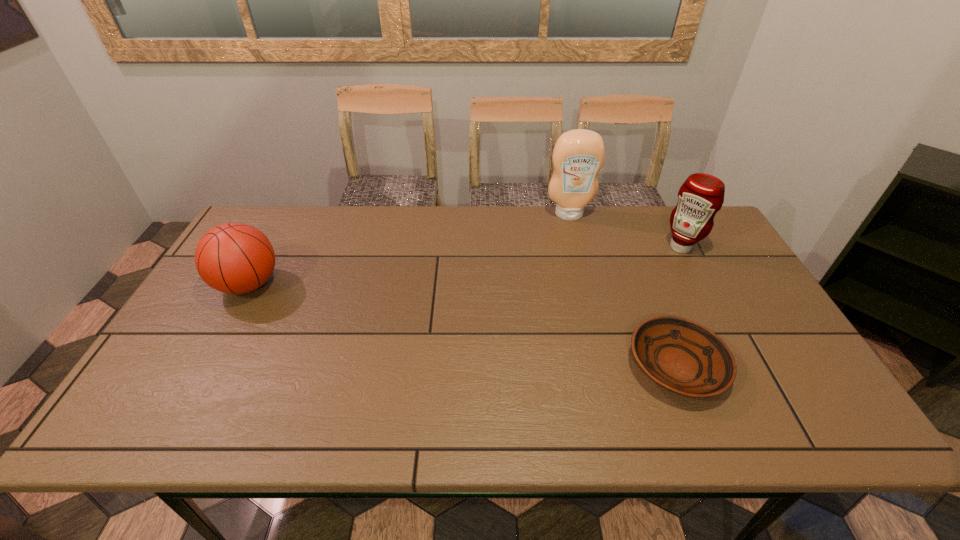
At what (x,y) coordinates should I click in order to perform the action: click on the left condiment. Please return your answer as a coordinate pair (x, y). Image resolution: width=960 pixels, height=540 pixels. Looking at the image, I should click on (578, 155).

Locate an element on the screen. the farthest object is located at coordinates (578, 155).

Find the location of a particular element. the right condiment is located at coordinates (701, 196).

Image resolution: width=960 pixels, height=540 pixels. I want to click on the second farthest object, so click(701, 196).

Where is `the third farthest object`? The width and height of the screenshot is (960, 540). the third farthest object is located at coordinates (234, 258).

This screenshot has height=540, width=960. What are the coordinates of `basketball` in the screenshot? It's located at (234, 258).

Find the location of a particular element. The image size is (960, 540). the shortest object is located at coordinates (680, 355).

You are a GUI agent. You are given a task and a screenshot of the screen. Output one action in this format:
    pyautogui.click(x=<x>, y=<y>)
    Task: Click on the plate
    The width and height of the screenshot is (960, 540).
    Given the screenshot: What is the action you would take?
    pyautogui.click(x=680, y=355)

Image resolution: width=960 pixels, height=540 pixels. What are the coordinates of `free space located on the label of the farther condiment` in the screenshot? It's located at (588, 287).

Locate an element on the screen. free region located on the left of the nearer condiment is located at coordinates (546, 247).